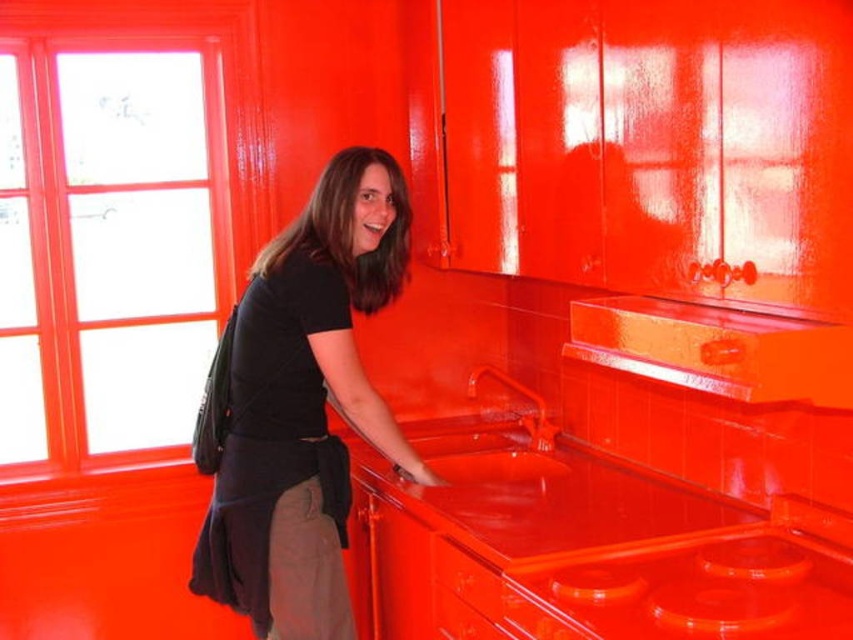
Question: Which object appears farthest from the camera in this image?

Choices:
 (A) matte black shirt at center
 (B) glossy orange countertop at lower center

Answer: (A)

Question: Does glossy orange countertop at lower center have a lesser width compared to matte black shirt at center?

Choices:
 (A) yes
 (B) no

Answer: (B)

Question: Is glossy orange countertop at lower center further to camera compared to matte black shirt at center?

Choices:
 (A) no
 (B) yes

Answer: (A)

Question: Is glossy orange countertop at lower center below matte black shirt at center?

Choices:
 (A) no
 (B) yes

Answer: (B)

Question: Which point appears closest to the camera in this image?

Choices:
 (A) tap(257, 285)
 (B) tap(480, 525)

Answer: (A)